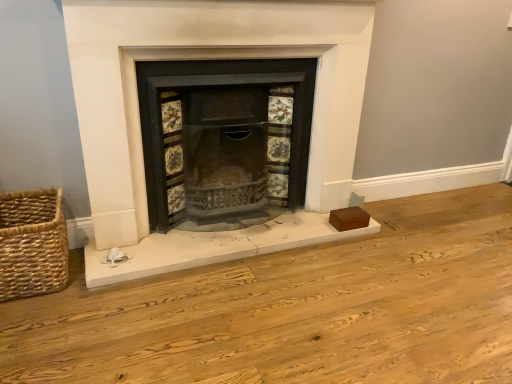
Find the location of a particular element. free location in front of matte black fireplace at center is located at coordinates (231, 312).